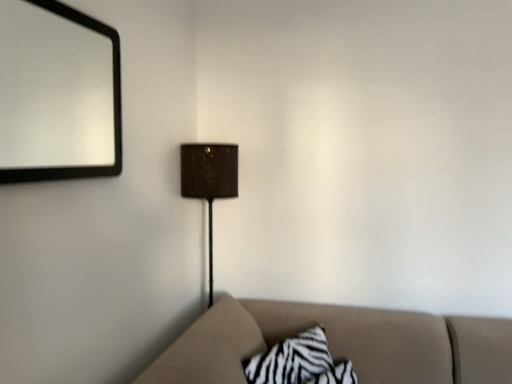
Describe the element at coordinates (209, 181) in the screenshot. I see `matte brown lampshade at center` at that location.

Looking at this image, what is the approximate width of black matte mirror at upper left?

black matte mirror at upper left is 2.53 inches in width.

Locate an element on the screen. The image size is (512, 384). zebra-patterned fabric pillow at lower center is located at coordinates (291, 360).

The width and height of the screenshot is (512, 384). Find the location of `matte brown lampshade at center`. matte brown lampshade at center is located at coordinates (209, 181).

Based on the photo, from the image's perspective, is zebra-patterned fabric pillow at lower center located beneath matte brown lampshade at center?

Indeed, from the image's perspective, zebra-patterned fabric pillow at lower center is shown beneath matte brown lampshade at center.

Is zebra-patterned fabric pillow at lower center spatially inside matte brown lampshade at center, or outside of it?

zebra-patterned fabric pillow at lower center is not inside matte brown lampshade at center, it's outside.

Locate an element on the screen. pillow below the matte brown lampshade at center (from the image's perspective) is located at coordinates (291, 360).

Can you confirm if zebra-patterned fabric pillow at lower center is wider than matte brown lampshade at center?

No, zebra-patterned fabric pillow at lower center is not wider than matte brown lampshade at center.

From a real-world perspective, which is physically above, black matte mirror at upper left or matte brown lampshade at center?

black matte mirror at upper left.

Looking at this image, can you confirm if black matte mirror at upper left is positioned to the right of matte brown lampshade at center?

No.

Is matte brown lampshade at center completely or partially inside black matte mirror at upper left?

No, matte brown lampshade at center is located outside of black matte mirror at upper left.

Does point (70, 86) come in front of point (325, 366)?

No.

Who is more distant, black matte mirror at upper left or zebra-patterned fabric pillow at lower center?

zebra-patterned fabric pillow at lower center is further away from the camera.

In the scene shown: From the image's perspective, which object appears higher, black matte mirror at upper left or zebra-patterned fabric pillow at lower center?

black matte mirror at upper left.

How many degrees apart are the facing directions of black matte mirror at upper left and zebra-patterned fabric pillow at lower center?

The angular difference between black matte mirror at upper left and zebra-patterned fabric pillow at lower center is 42 degrees.

Considering the sizes of objects zebra-patterned fabric pillow at lower center and black matte mirror at upper left in the image provided, who is thinner, zebra-patterned fabric pillow at lower center or black matte mirror at upper left?

Thinner between the two is black matte mirror at upper left.

Does point (322, 336) come behind point (35, 28)?

No, it is in front of (35, 28).

In the image, is zebra-patterned fabric pillow at lower center on the left side or the right side of black matte mirror at upper left?

In the image, zebra-patterned fabric pillow at lower center appears on the right side of black matte mirror at upper left.

Identify the location of mirror in front of the zebra-patterned fabric pillow at lower center. The width and height of the screenshot is (512, 384). (53, 90).

Consider the image. Can you confirm if matte brown lampshade at center is thinner than zebra-patterned fabric pillow at lower center?

Incorrect, the width of matte brown lampshade at center is not less than that of zebra-patterned fabric pillow at lower center.

Between matte brown lampshade at center and zebra-patterned fabric pillow at lower center, which one has less height?

zebra-patterned fabric pillow at lower center is shorter.

How distant is matte brown lampshade at center from zebra-patterned fabric pillow at lower center?

matte brown lampshade at center and zebra-patterned fabric pillow at lower center are 67.93 centimeters apart from each other.

Considering the sizes of matte brown lampshade at center and zebra-patterned fabric pillow at lower center in the image, is matte brown lampshade at center bigger or smaller than zebra-patterned fabric pillow at lower center?

In the image, matte brown lampshade at center appears to be larger than zebra-patterned fabric pillow at lower center.

From a real-world perspective, is matte brown lampshade at center on top of black matte mirror at upper left?

No, from a real-world perspective, matte brown lampshade at center is not above black matte mirror at upper left.

Is matte brown lampshade at center at the right side of black matte mirror at upper left?

Indeed, matte brown lampshade at center is positioned on the right side of black matte mirror at upper left.

Does matte brown lampshade at center have a greater height compared to black matte mirror at upper left?

Indeed, matte brown lampshade at center has a greater height compared to black matte mirror at upper left.

In the scene shown: Which object is more forward, matte brown lampshade at center or black matte mirror at upper left?

black matte mirror at upper left is in front.

Where is `pillow to the right of matte brown lampshade at center`? The height and width of the screenshot is (384, 512). pillow to the right of matte brown lampshade at center is located at coordinates (291, 360).

Where is `mirror that appears above the matte brown lampshade at center (from a real-world perspective)`? The height and width of the screenshot is (384, 512). mirror that appears above the matte brown lampshade at center (from a real-world perspective) is located at coordinates (53, 90).

Considering their positions, is zebra-patterned fabric pillow at lower center positioned closer to black matte mirror at upper left than matte brown lampshade at center?

Based on the image, matte brown lampshade at center appears to be nearer to black matte mirror at upper left.

Based on the photo, based on their spatial positions, is zebra-patterned fabric pillow at lower center or black matte mirror at upper left further from matte brown lampshade at center?

black matte mirror at upper left lies further to matte brown lampshade at center than the other object.

Based on their spatial positions, is matte brown lampshade at center or black matte mirror at upper left further from zebra-patterned fabric pillow at lower center?

Among the two, black matte mirror at upper left is located further to zebra-patterned fabric pillow at lower center.

Estimate the real-world distances between objects in this image. Which object is closer to matte brown lampshade at center, black matte mirror at upper left or zebra-patterned fabric pillow at lower center?

zebra-patterned fabric pillow at lower center is positioned closer to the anchor matte brown lampshade at center.

Which object lies further to the anchor point zebra-patterned fabric pillow at lower center, black matte mirror at upper left or matte brown lampshade at center?

Based on the image, black matte mirror at upper left appears to be further to zebra-patterned fabric pillow at lower center.

Based on their spatial positions, is matte brown lampshade at center or zebra-patterned fabric pillow at lower center further from black matte mirror at upper left?

Among the two, zebra-patterned fabric pillow at lower center is located further to black matte mirror at upper left.

Locate an element on the screen. The image size is (512, 384). lamp between black matte mirror at upper left and zebra-patterned fabric pillow at lower center from top to bottom is located at coordinates [x=209, y=181].